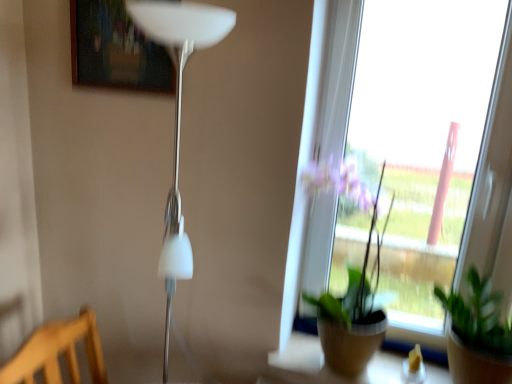
Question: Is white glossy floor lamp at left completely or partially outside of green matte plant at center, the 2th houseplant from the right?

Choices:
 (A) yes
 (B) no

Answer: (A)

Question: Are white glossy floor lamp at left and green matte plant at center, marked as the 1th houseplant in a left-to-right arrangement, beside each other?

Choices:
 (A) yes
 (B) no

Answer: (B)

Question: Does white glossy floor lamp at left have a greater height compared to green matte plant at center, the 2th houseplant from the right?

Choices:
 (A) no
 (B) yes

Answer: (B)

Question: Is white glossy floor lamp at left facing away from green matte plant at center, marked as the 1th houseplant in a left-to-right arrangement?

Choices:
 (A) no
 (B) yes

Answer: (A)

Question: From a real-world perspective, is white glossy floor lamp at left positioned under green matte plant at center, marked as the 1th houseplant in a left-to-right arrangement, based on gravity?

Choices:
 (A) no
 (B) yes

Answer: (A)

Question: Is white glossy floor lamp at left further to camera compared to green matte plant at center, marked as the 1th houseplant in a left-to-right arrangement?

Choices:
 (A) yes
 (B) no

Answer: (B)

Question: Does white glossy floor lamp at left have a lesser height compared to wooden frame at upper center?

Choices:
 (A) no
 (B) yes

Answer: (A)

Question: Is white glossy floor lamp at left wider than wooden frame at upper center?

Choices:
 (A) no
 (B) yes

Answer: (B)

Question: Is white glossy floor lamp at left positioned behind wooden frame at upper center?

Choices:
 (A) yes
 (B) no

Answer: (B)

Question: From the image's perspective, is white glossy floor lamp at left located beneath wooden frame at upper center?

Choices:
 (A) yes
 (B) no

Answer: (A)

Question: From the image's perspective, is white glossy floor lamp at left above wooden frame at upper center?

Choices:
 (A) yes
 (B) no

Answer: (B)

Question: Is white glossy floor lamp at left not close to wooden frame at upper center?

Choices:
 (A) yes
 (B) no

Answer: (B)

Question: Does wooden frame at upper center appear on the left side of white glossy floor lamp at left?

Choices:
 (A) yes
 (B) no

Answer: (A)